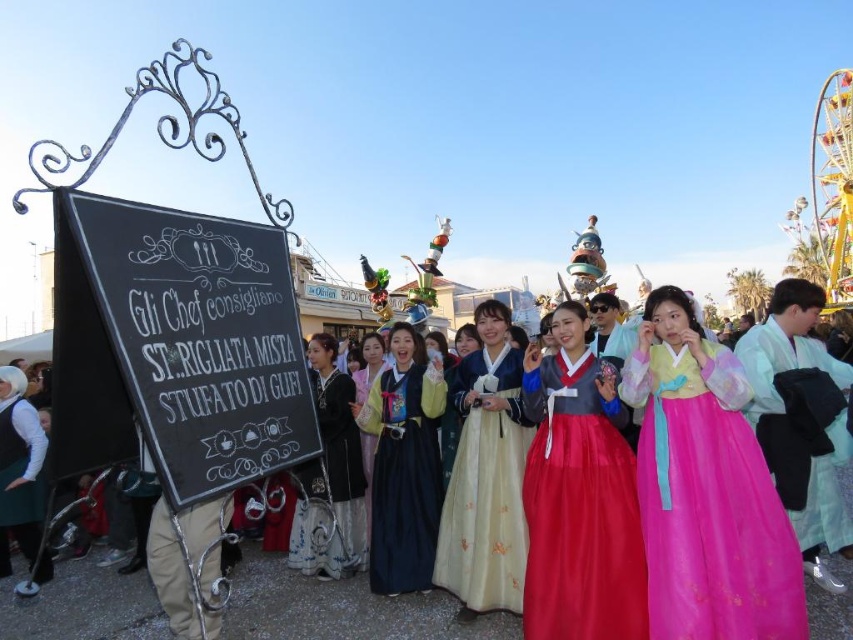
Is light blue silk kimono at center positioned behind silk blue dress at center?

No, it is not.

The width and height of the screenshot is (853, 640). I want to click on light blue silk kimono at center, so click(x=799, y=419).

I want to click on light blue silk kimono at center, so click(799, 419).

Is point (376, 388) less distant than point (349, 496)?

That is False.

This screenshot has height=640, width=853. I want to click on matte black dress at center, so click(403, 477).

Does black chalkboard at left have a greater width compared to pink satin dress at center?

Indeed, black chalkboard at left has a greater width compared to pink satin dress at center.

In the scene shown: Is black chalkboard at left to the left of pink satin dress at center from the viewer's perspective?

Yes, black chalkboard at left is to the left of pink satin dress at center.

You are a GUI agent. You are given a task and a screenshot of the screen. Output one action in this format:
    pyautogui.click(x=<x>, y=<y>)
    Task: Click on the black chalkboard at left
    
    Given the screenshot: What is the action you would take?
    pyautogui.click(x=175, y=346)